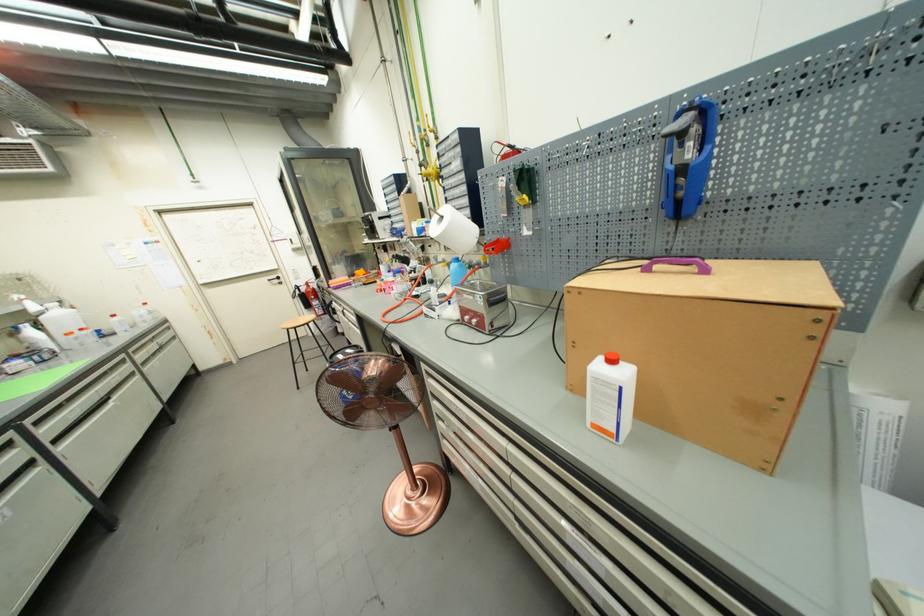
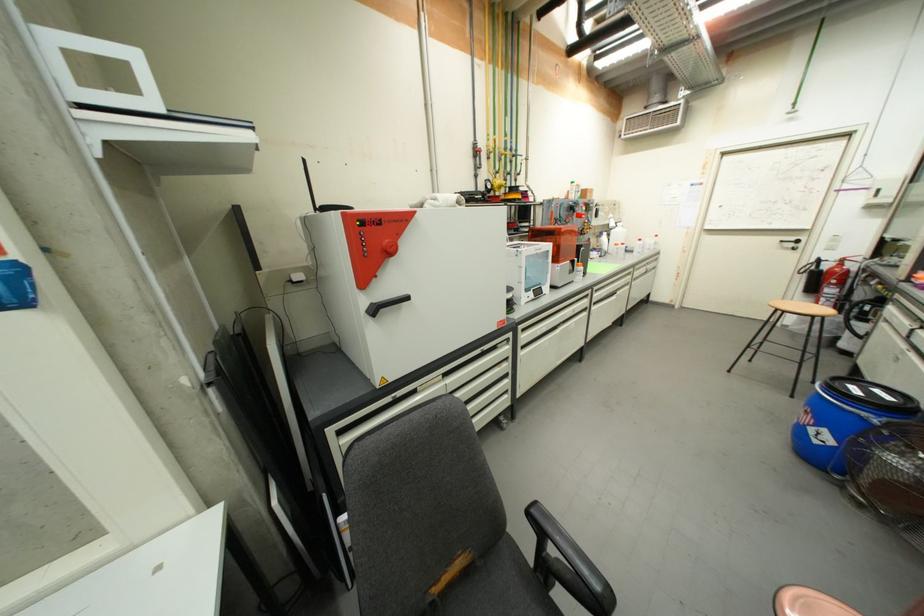
The images are taken continuously from a first-person perspective. In which direction is your viewpoint rotating?

The camera's rotation is toward left-down.